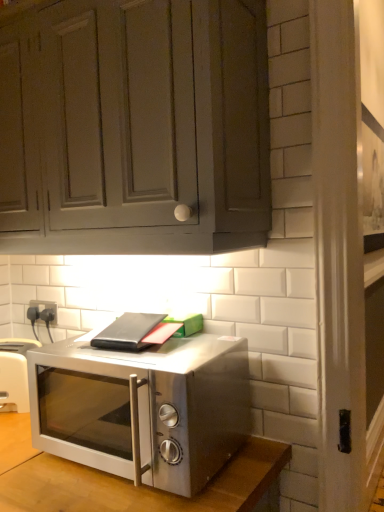
Question: Considering the relative sizes of satin silver microwave at center and matte gray cabinet at upper center in the image provided, is satin silver microwave at center wider than matte gray cabinet at upper center?

Choices:
 (A) yes
 (B) no

Answer: (A)

Question: Could you tell me if satin silver microwave at center is turned towards matte gray cabinet at upper center?

Choices:
 (A) no
 (B) yes

Answer: (A)

Question: Is satin silver microwave at center beside matte gray cabinet at upper center?

Choices:
 (A) no
 (B) yes

Answer: (A)

Question: Can you confirm if satin silver microwave at center is bigger than matte gray cabinet at upper center?

Choices:
 (A) yes
 (B) no

Answer: (B)

Question: From a real-world perspective, is satin silver microwave at center on matte gray cabinet at upper center?

Choices:
 (A) no
 (B) yes

Answer: (A)

Question: Is satin silver microwave at center looking in the opposite direction of matte gray cabinet at upper center?

Choices:
 (A) yes
 (B) no

Answer: (B)

Question: Can you confirm if matte gray cabinet at upper center is wider than satin silver microwave at center?

Choices:
 (A) no
 (B) yes

Answer: (A)

Question: Considering the relative sizes of matte gray cabinet at upper center and satin silver microwave at center in the image provided, is matte gray cabinet at upper center shorter than satin silver microwave at center?

Choices:
 (A) yes
 (B) no

Answer: (B)

Question: Is matte gray cabinet at upper center smaller than satin silver microwave at center?

Choices:
 (A) no
 (B) yes

Answer: (A)

Question: Could you tell me if matte gray cabinet at upper center is turned towards satin silver microwave at center?

Choices:
 (A) yes
 (B) no

Answer: (B)

Question: Does matte gray cabinet at upper center come in front of satin silver microwave at center?

Choices:
 (A) no
 (B) yes

Answer: (B)

Question: Considering the relative sizes of matte gray cabinet at upper center and satin silver microwave at center in the image provided, is matte gray cabinet at upper center bigger than satin silver microwave at center?

Choices:
 (A) yes
 (B) no

Answer: (A)

Question: Can you confirm if satin silver microwave at center is taller than satin silver toaster at lower left?

Choices:
 (A) yes
 (B) no

Answer: (A)